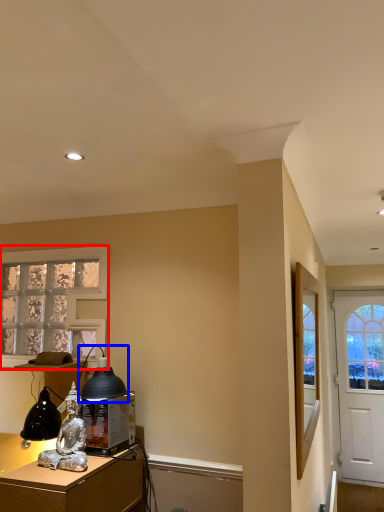
Question: Among these objects, which one is nearest to the camera, window (highlighted by a red box) or table lamp (highlighted by a blue box)?

Choices:
 (A) window
 (B) table lamp

Answer: (B)